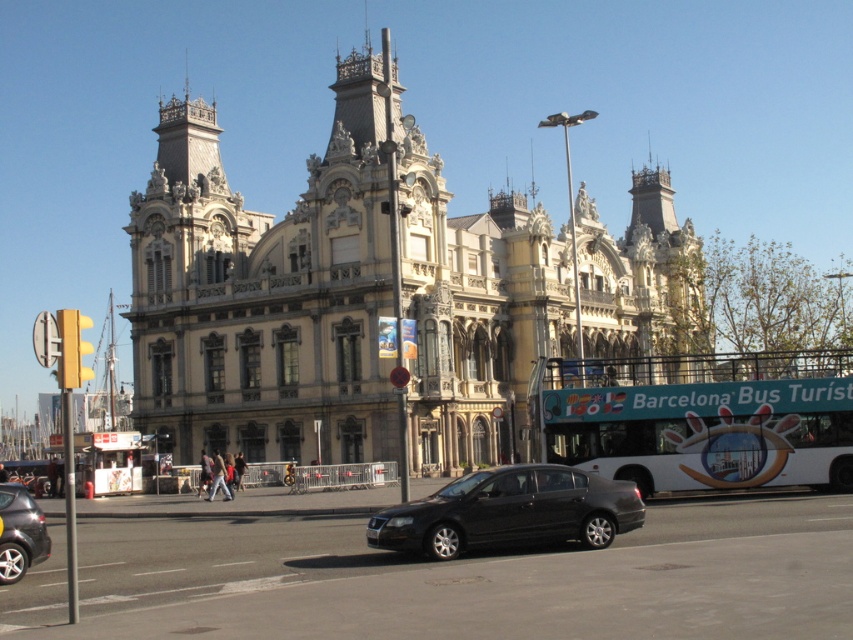
Does white glossy bus at lower right have a greater height compared to matte black sedan at center?

Yes.

Between point (755, 426) and point (509, 536), which one is positioned in front?

Point (509, 536) is in front.

Is point (834, 442) behind point (490, 518)?

Yes.

Image resolution: width=853 pixels, height=640 pixels. What are the coordinates of `white glossy bus at lower right` in the screenshot? It's located at (703, 419).

Between stone textured building at center and white glossy bus at lower right, which one is positioned higher?

Positioned higher is stone textured building at center.

Does point (216, 408) lie behind point (776, 365)?

Yes, it is.

Where is `stone textured building at center`? stone textured building at center is located at coordinates (376, 294).

Can you confirm if stone textured building at center is positioned below metallic gray sedan at lower left?

Actually, stone textured building at center is above metallic gray sedan at lower left.

From the picture: Is stone textured building at center bigger than metallic gray sedan at lower left?

Yes.

At what (x,y) coordinates should I click in order to perform the action: click on stone textured building at center. Please return your answer as a coordinate pair (x, y). Looking at the image, I should click on (376, 294).